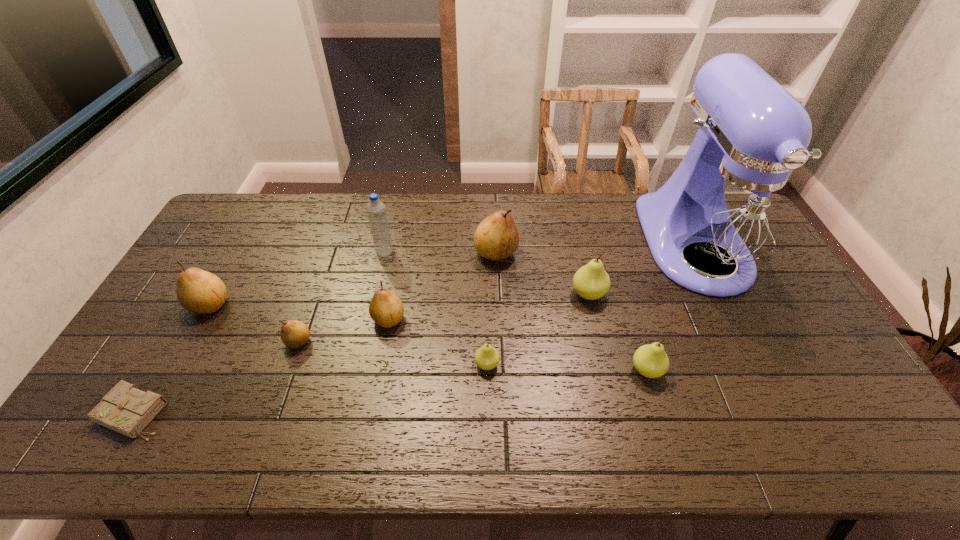
In order to click on mixer in this screenshot , I will do `click(732, 206)`.

The height and width of the screenshot is (540, 960). I want to click on blue mixer, so click(732, 206).

The height and width of the screenshot is (540, 960). Find the location of `blue water bottle`. blue water bottle is located at coordinates (376, 211).

Where is `the farthest pear`? The width and height of the screenshot is (960, 540). the farthest pear is located at coordinates (496, 237).

Find the location of a particular element. This screenshot has width=960, height=540. the farthest brown pear is located at coordinates tap(496, 237).

Where is `the second green pear from right to left`? the second green pear from right to left is located at coordinates (591, 282).

Where is `the biggest green pear`? The height and width of the screenshot is (540, 960). the biggest green pear is located at coordinates (591, 282).

Identify the location of the third smallest brown pear. (198, 291).

You are a GUI agent. You are given a task and a screenshot of the screen. Output one action in this format:
    pyautogui.click(x=<x>, y=<y>)
    Task: Click on the leftmost pear
    
    Given the screenshot: What is the action you would take?
    pyautogui.click(x=198, y=291)

Where is `the ninth object from left to right`? the ninth object from left to right is located at coordinates (650, 360).